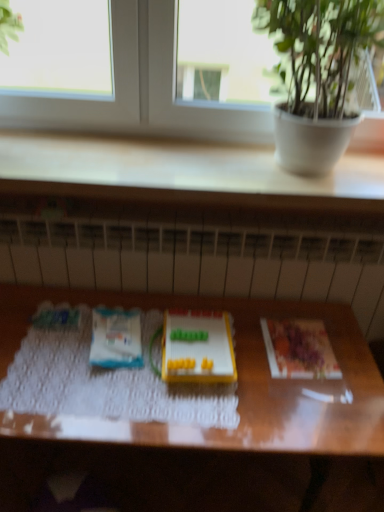
Locate an element on the screen. vacant area that is situated to the right of printed paper at right, the 2th paperback book viewed from the left is located at coordinates click(349, 348).